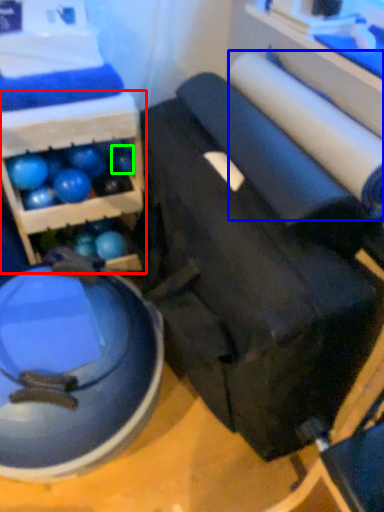
Question: Which is nearer to the shelf (highlighted by a red box)? toilet paper (highlighted by a blue box) or ball (highlighted by a green box).

Choices:
 (A) toilet paper
 (B) ball

Answer: (B)